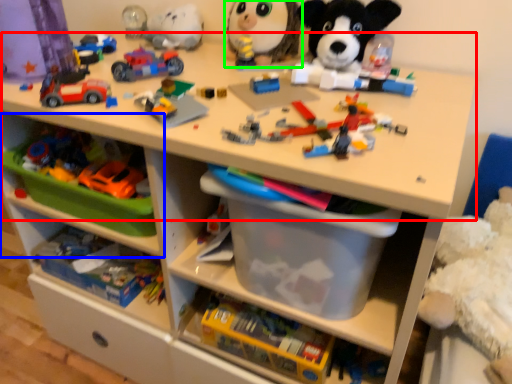
Question: Which object is the closest to the changing table (highlighted by a red box)? Choose among these: shelf (highlighted by a blue box) or toy (highlighted by a green box).

Choices:
 (A) shelf
 (B) toy

Answer: (B)